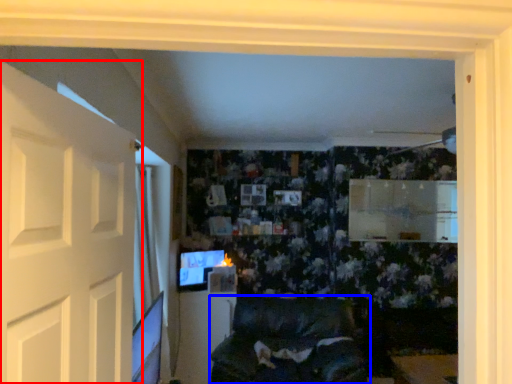
Question: Which of the following is the farthest to the observer, door (highlighted by a red box) or furniture (highlighted by a blue box)?

Choices:
 (A) door
 (B) furniture

Answer: (B)